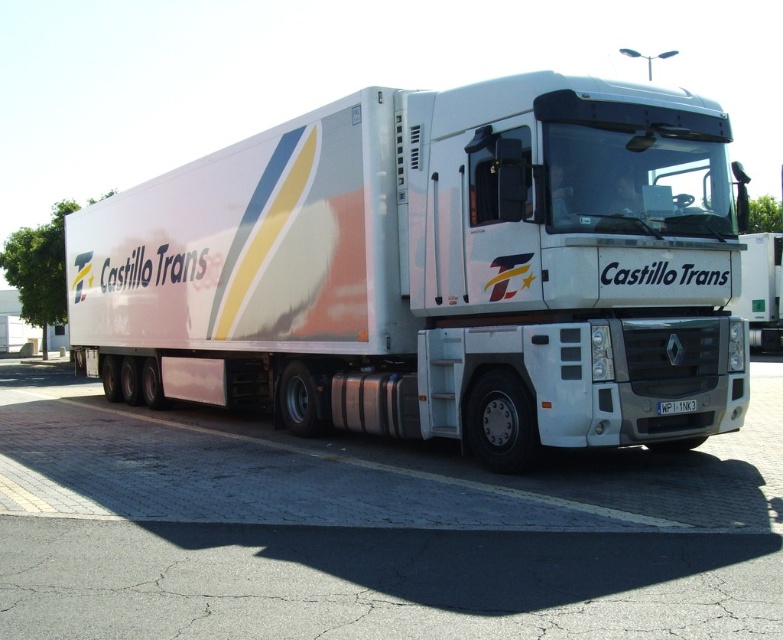
You are standing in front of a Castillo Trans semi truck. The truck has a white glossy trailer at center. Where would you look to find the point labeled as point (435, 269)?

The point labeled as point (435, 269) is located on the white glossy trailer truck at center.

Based on the photo, you are a delivery driver who needs to park your white glossy trailer truck at center in a parking spot that is exactly the width of the white plastic license plate at center. Will the truck fit in the parking spot?

The white glossy trailer truck at center is wider than the white plastic license plate at center, so it will not fit in a parking spot that is exactly the width of the license plate.

You are a delivery driver who needs to enter a low clearance tunnel. You observe the white glossy trailer truck at center and the white glossy truck at center in the image. Which vehicle should you avoid driving through the tunnel to prevent damage?

The white glossy trailer truck at center has a greater height compared to the white glossy truck at center, so you should avoid driving the white glossy trailer truck at center through the tunnel to prevent damage.